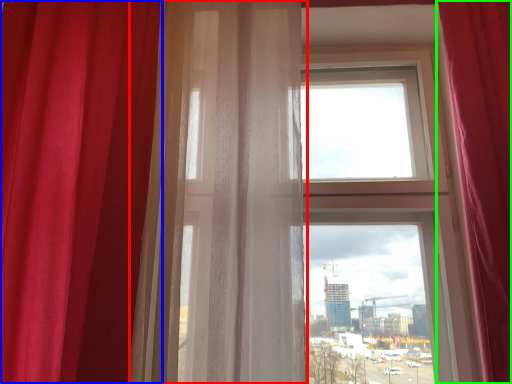
Question: Which is farther away from curtain (highlighted by a red box)? curtain (highlighted by a blue box) or curtain (highlighted by a green box)?

Choices:
 (A) curtain
 (B) curtain

Answer: (B)